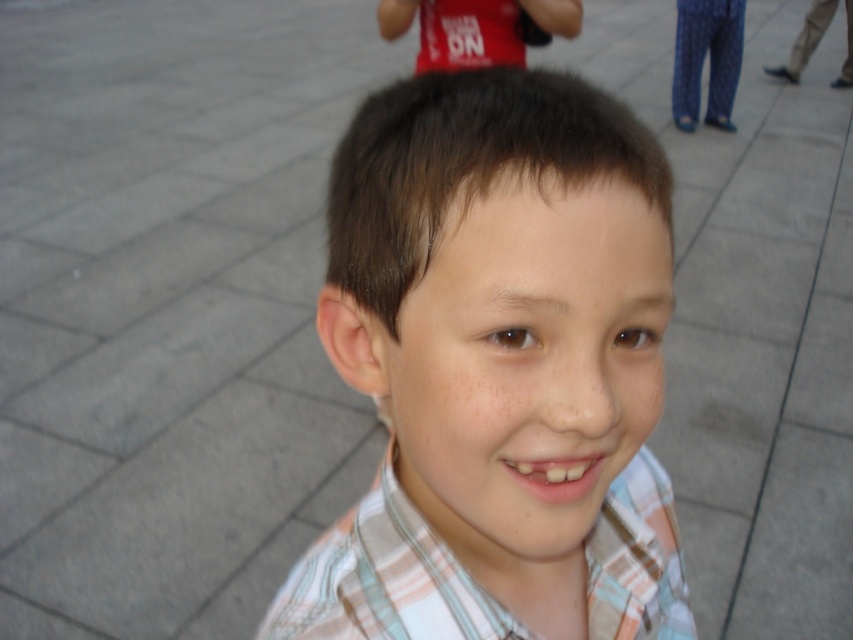
Based on the photo, the user is trying to decide which shirt to wear for an outdoor event. They have two options in their wardrobe labeled as the plaid shirt at center and the plaid cotton shirt at center. Based on the image description, which shirt is bigger?

The plaid shirt at center is larger in size compared to the plaid cotton shirt at center, so the plaid shirt at center would be the bigger option.

You are standing at the position of point (454, 38) and want to walk towards the boy in the image. Is the point (663, 564) in your path?

Yes, the point (663, 564) is in front of point (454, 38), so it is in your path towards the boy.

The scene shows a young boy standing on a tiled pavement. The boy is wearing a plaid cotton shirt at center. A point is marked at coordinates (384,579). According to the image description, where is this point located in relation to the plaid cotton shirt at center?

The point at coordinates (384,579) marks the plaid cotton shirt at center.